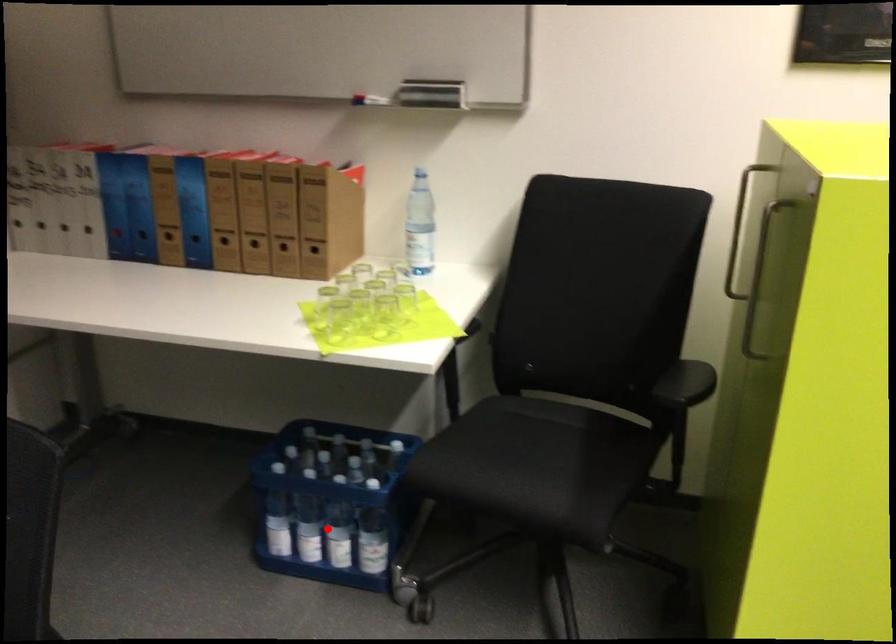
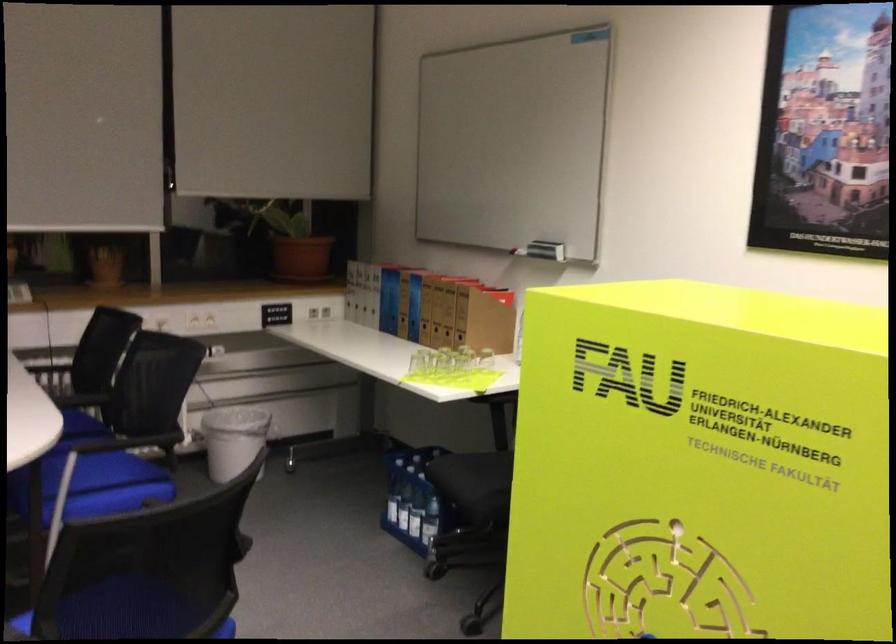
Where in the second image is the point corresponding to the highlighted location from the first image?

(416, 514)